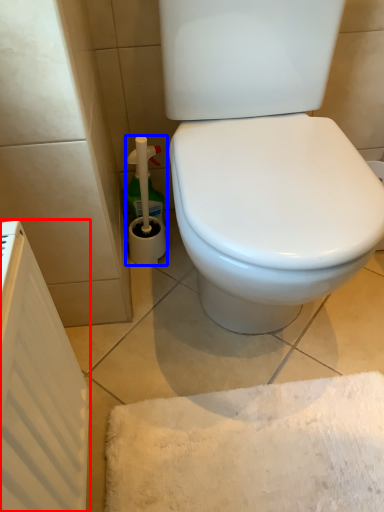
Question: Which of the following is the closest to the observer, radiator (highlighted by a red box) or cleaning product (highlighted by a blue box)?

Choices:
 (A) radiator
 (B) cleaning product

Answer: (A)